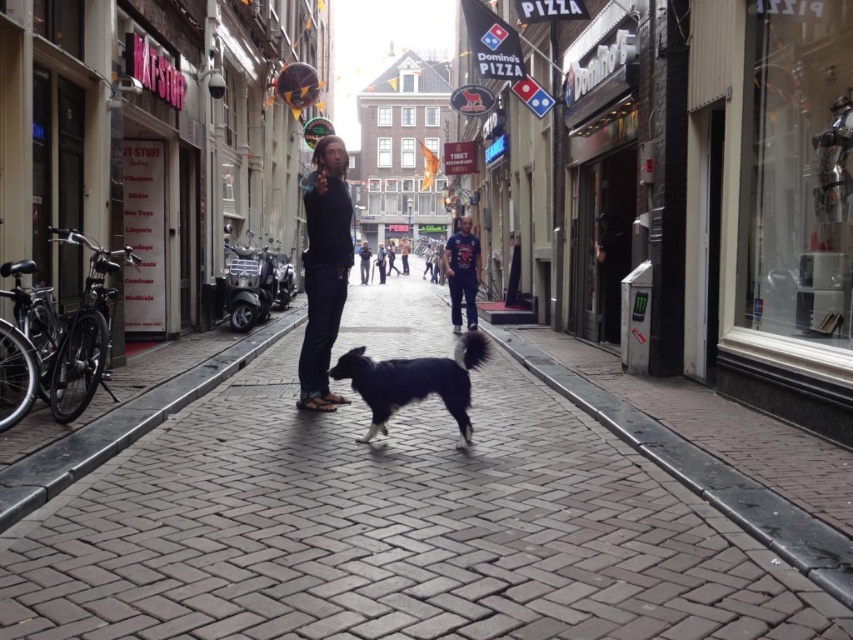
Question: Does brick pavement at center appear under blue denim jeans at center?

Choices:
 (A) yes
 (B) no

Answer: (A)

Question: Can you confirm if brick pavement at center is positioned above blue denim jeans at center?

Choices:
 (A) no
 (B) yes

Answer: (A)

Question: Can you confirm if brick pavement at center is positioned below black fur dog at center?

Choices:
 (A) no
 (B) yes

Answer: (B)

Question: Among these points, which one is nearest to the camera?

Choices:
 (A) (425, 372)
 (B) (614, 596)
 (C) (444, 253)
 (D) (318, 285)

Answer: (B)

Question: Based on their relative distances, which object is farther from the black fur dog at center?

Choices:
 (A) dark blue jeans at center
 (B) blue denim jeans at center
 (C) brick pavement at center

Answer: (B)

Question: Estimate the real-world distances between objects in this image. Which object is farther from the brick pavement at center?

Choices:
 (A) dark blue jeans at center
 (B) blue denim jeans at center
 (C) black fur dog at center

Answer: (B)